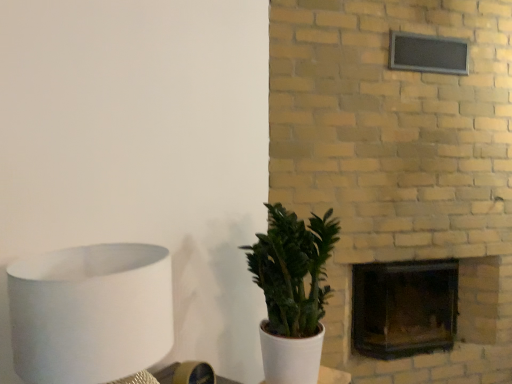
Question: Is black glass fireplace at center-right wider than white matte lampshade at left?

Choices:
 (A) yes
 (B) no

Answer: (A)

Question: Can you confirm if black glass fireplace at center-right is positioned to the right of white matte lampshade at left?

Choices:
 (A) yes
 (B) no

Answer: (A)

Question: Considering the relative sizes of black glass fireplace at center-right and white matte lampshade at left in the image provided, is black glass fireplace at center-right taller than white matte lampshade at left?

Choices:
 (A) no
 (B) yes

Answer: (B)

Question: Considering the relative sizes of black glass fireplace at center-right and white matte lampshade at left in the image provided, is black glass fireplace at center-right shorter than white matte lampshade at left?

Choices:
 (A) no
 (B) yes

Answer: (A)

Question: Is black glass fireplace at center-right positioned far away from white matte lampshade at left?

Choices:
 (A) no
 (B) yes

Answer: (B)

Question: Does black glass fireplace at center-right come behind white matte lampshade at left?

Choices:
 (A) yes
 (B) no

Answer: (A)

Question: From the image's perspective, is green matte plant at center located beneath black glass fireplace at center-right?

Choices:
 (A) no
 (B) yes

Answer: (A)

Question: From a real-world perspective, is green matte plant at center below black glass fireplace at center-right?

Choices:
 (A) no
 (B) yes

Answer: (A)

Question: Are green matte plant at center and black glass fireplace at center-right located far from each other?

Choices:
 (A) no
 (B) yes

Answer: (B)

Question: Considering the relative sizes of green matte plant at center and black glass fireplace at center-right in the image provided, is green matte plant at center thinner than black glass fireplace at center-right?

Choices:
 (A) yes
 (B) no

Answer: (A)

Question: Are green matte plant at center and black glass fireplace at center-right beside each other?

Choices:
 (A) no
 (B) yes

Answer: (A)

Question: From a real-world perspective, does green matte plant at center stand above black glass fireplace at center-right?

Choices:
 (A) no
 (B) yes

Answer: (B)

Question: Is white matte lampshade at left to the right of green matte plant at center from the viewer's perspective?

Choices:
 (A) yes
 (B) no

Answer: (B)